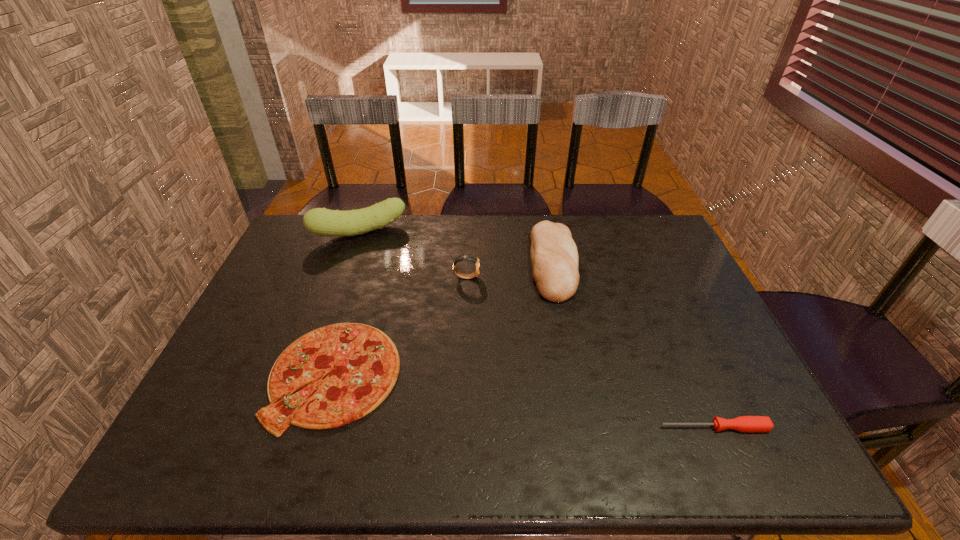
Identify the location of free region located 0.240m at the tip of the screwdriver. The width and height of the screenshot is (960, 540). (553, 428).

Where is `blank space located on the left of the pizza`? The image size is (960, 540). blank space located on the left of the pizza is located at coordinates [242, 374].

This screenshot has width=960, height=540. Find the location of `cucumber present at the far edge`. cucumber present at the far edge is located at coordinates (320, 221).

Identify the location of bread located at the far edge. The width and height of the screenshot is (960, 540). (554, 257).

Identify the location of screwdriver that is at the near edge. This screenshot has height=540, width=960. (742, 423).

At what (x,y) coordinates should I click in order to perform the action: click on pizza that is at the near edge. Please return your answer as a coordinate pair (x, y). Looking at the image, I should click on (362, 363).

What are the coordinates of `cucumber present at the left edge` in the screenshot? It's located at (320, 221).

Where is `pizza that is at the left edge`? The height and width of the screenshot is (540, 960). pizza that is at the left edge is located at coordinates (362, 363).

The height and width of the screenshot is (540, 960). What are the coordinates of `object that is at the right edge` in the screenshot? It's located at tap(742, 423).

You are a GUI agent. You are given a task and a screenshot of the screen. Output one action in this format:
    pyautogui.click(x=<x>, y=<y>)
    Task: Click on the object that is at the far left corner
    
    Given the screenshot: What is the action you would take?
    pyautogui.click(x=320, y=221)